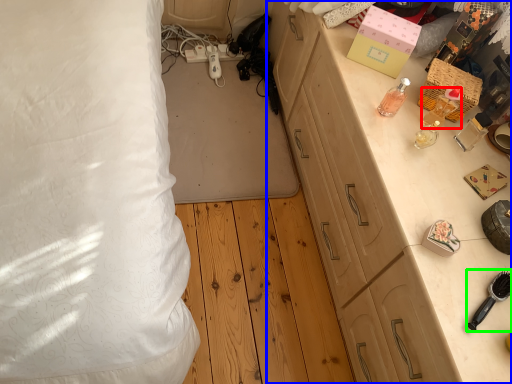
Question: Which object is the closest to the perfume (highlighted by a red box)? Choose among these: cabinetry (highlighted by a blue box) or brush (highlighted by a green box).

Choices:
 (A) cabinetry
 (B) brush

Answer: (A)